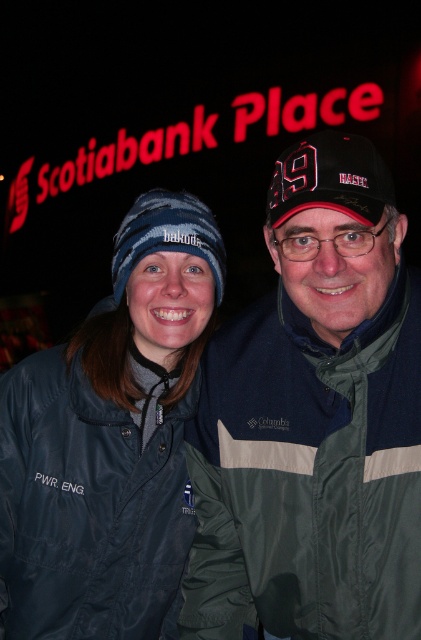
Question: Which point is closer to the camera taking this photo?

Choices:
 (A) (130, 385)
 (B) (316, 138)
 (C) (210, 214)

Answer: (B)

Question: Which point is closer to the camera?

Choices:
 (A) dark blue nylon jacket at center
 (B) black fabric cap at center
 (C) green nylon jacket at center

Answer: (C)

Question: Does green nylon jacket at center have a greater width compared to blue knit beanie at center?

Choices:
 (A) no
 (B) yes

Answer: (B)

Question: Which object is the closest to the green nylon jacket at center?

Choices:
 (A) blue knit beanie at center
 (B) black fabric cap at center
 (C) dark blue nylon jacket at center

Answer: (C)

Question: Does black fabric cap at center lie in front of blue knit beanie at center?

Choices:
 (A) yes
 (B) no

Answer: (A)

Question: Does dark blue nylon jacket at center come in front of black fabric cap at center?

Choices:
 (A) yes
 (B) no

Answer: (A)